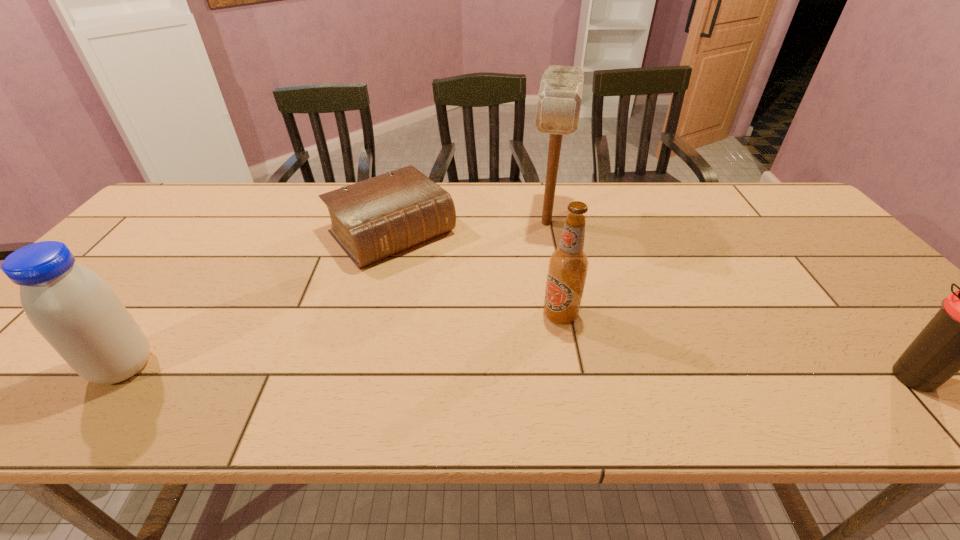
Where is `the leftmost object`? the leftmost object is located at coordinates (75, 310).

Identify the location of thermos bottle. (959, 337).

Locate an element on the screen. This screenshot has height=540, width=960. the second shortest object is located at coordinates (959, 337).

The width and height of the screenshot is (960, 540). What are the coordinates of `the fourth object from right to left` in the screenshot? It's located at (371, 220).

Find the location of a particular element. The width and height of the screenshot is (960, 540). the shortest object is located at coordinates (371, 220).

What are the coordinates of `beer bottle` in the screenshot? It's located at (568, 265).

You are a GUI agent. You are given a task and a screenshot of the screen. Output one action in this format:
    pyautogui.click(x=<x>, y=<y>)
    Task: Click on the mallet
    The height and width of the screenshot is (540, 960).
    Given the screenshot: What is the action you would take?
    pyautogui.click(x=559, y=99)

What are the coordinates of `vacant space situated on the back of the soya milk` in the screenshot? It's located at (156, 325).

I want to click on vacant position located on the back of the rightmost object, so click(x=802, y=253).

I want to click on free region located on the spine side of the Bible, so click(492, 333).